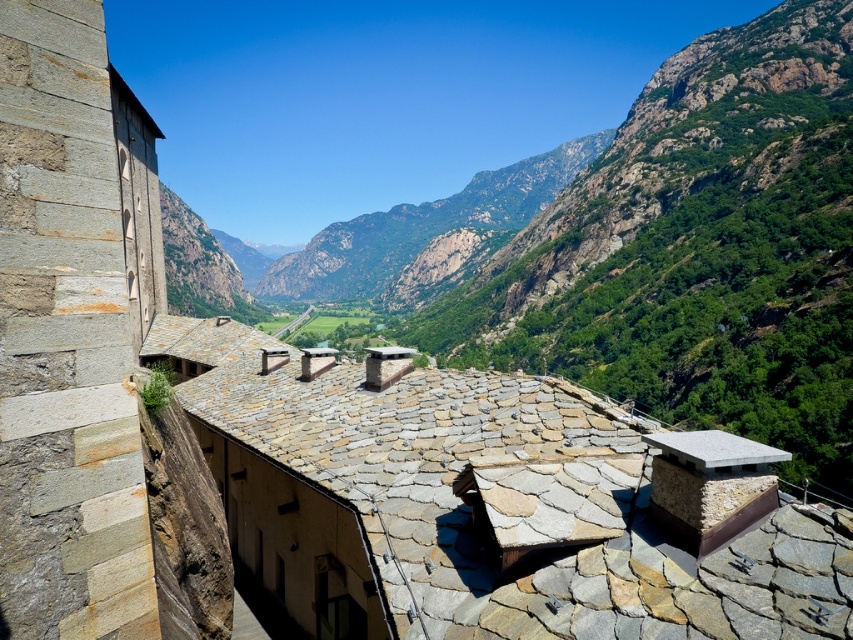
You are standing on the rooftop of the stone building and looking out. You see the green rocky mountain at center and the granite chimney at center. Which one appears taller from your vantage point?

The green rocky mountain at center appears taller than the granite chimney at center from your vantage point on the rooftop.

You are standing on the rooftop of the stone building and want to hike to the green rocky mountain at center. If your average hiking speed is 3.5 km per hour, how many hours will it take to reach the mountain?

The distance between you and the green rocky mountain at center is 413.87 meters. Converting meters to kilometers, it becomes 0.41387 km. Dividing the distance by your hiking speed of 3.5 km per hour gives approximately 0.118 hours, which is roughly 7.1 minutes. Therefore, it would take about 7 minutes to reach the mountain.